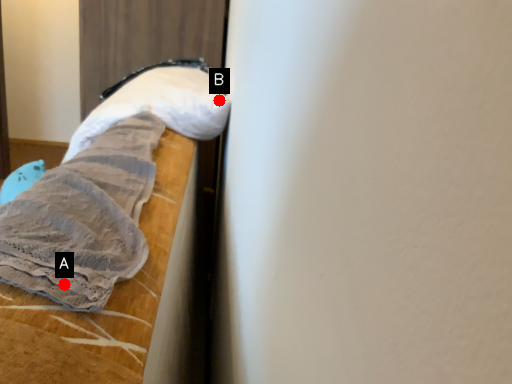
Question: Two points are circled on the image, labeled by A and B beside each circle. Which point is further to the camera?

Choices:
 (A) A is further
 (B) B is further

Answer: (B)